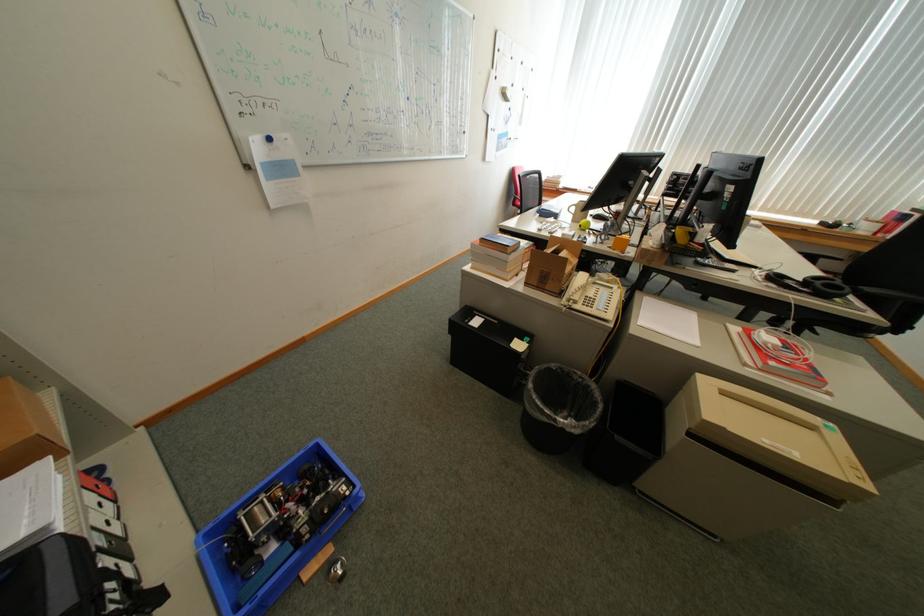
What do you see at coordinates (830, 261) in the screenshot? The height and width of the screenshot is (616, 924). I see `a chair armrest` at bounding box center [830, 261].